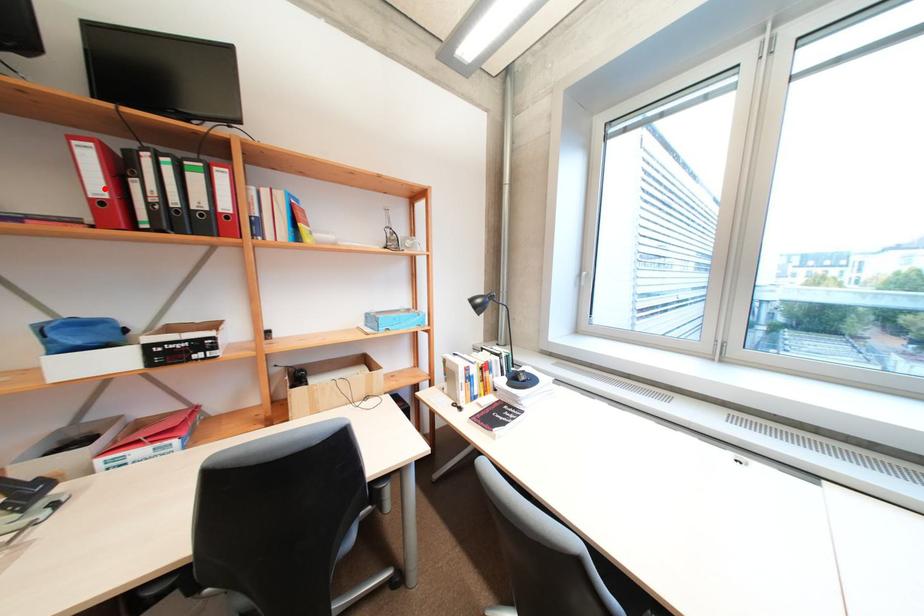
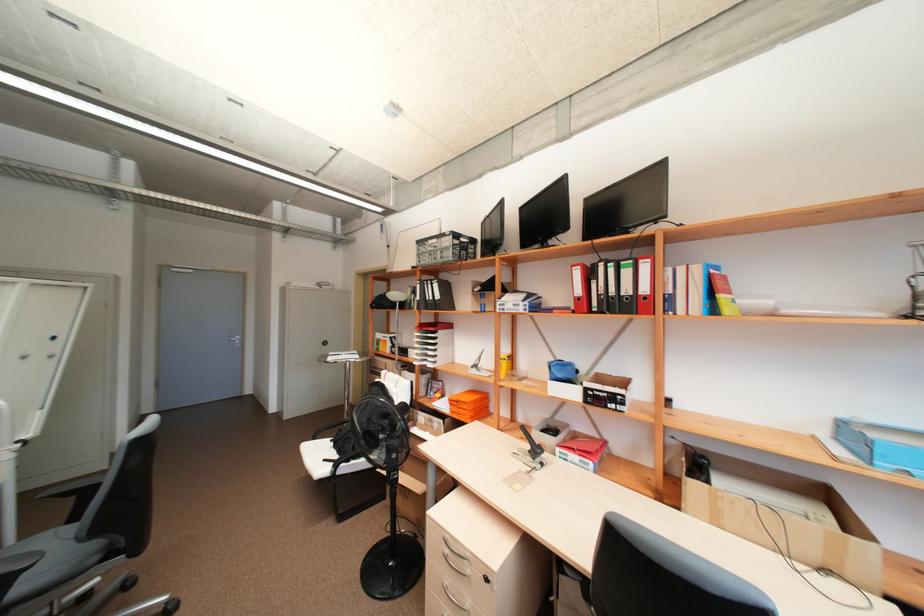
Find the pixel in the second image that matches the highlighted location in the first image.

(584, 291)